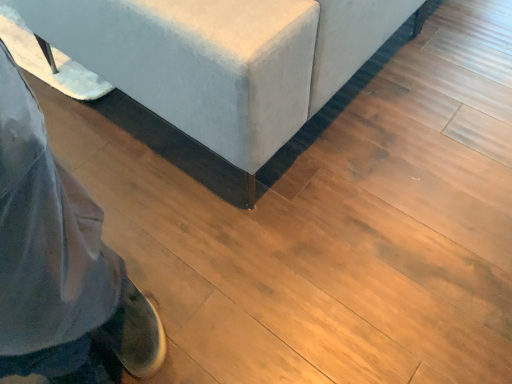
Locate an element on the screen. The width and height of the screenshot is (512, 384). vacant space in front of velvet fabric ottoman at center is located at coordinates (264, 231).